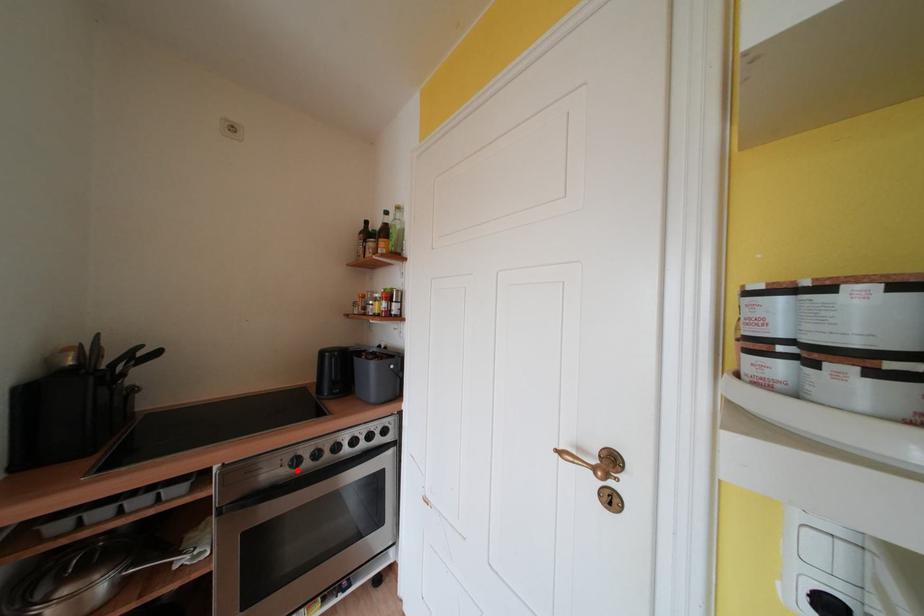
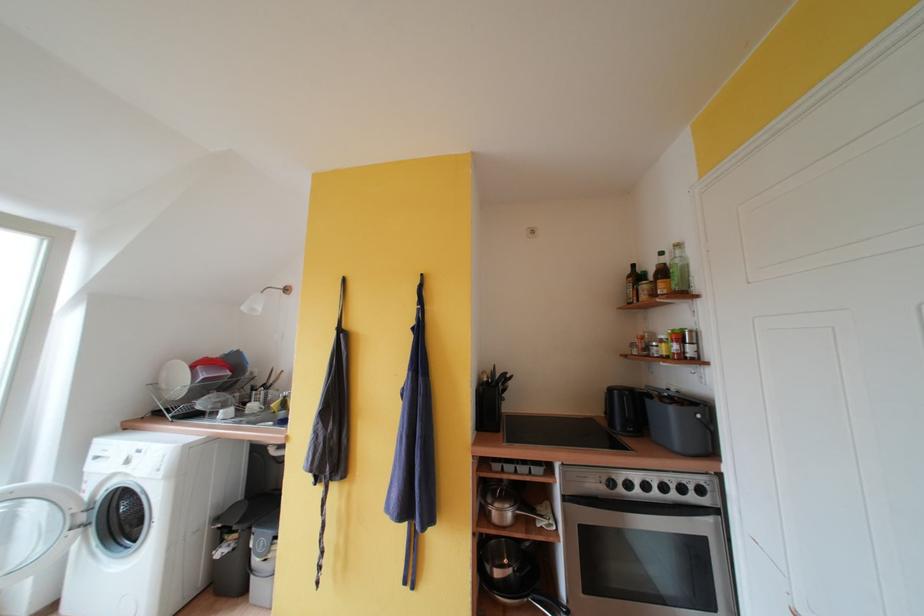
The point at the highlighted location is marked in the first image. Where is the corresponding point in the second image?

(614, 490)